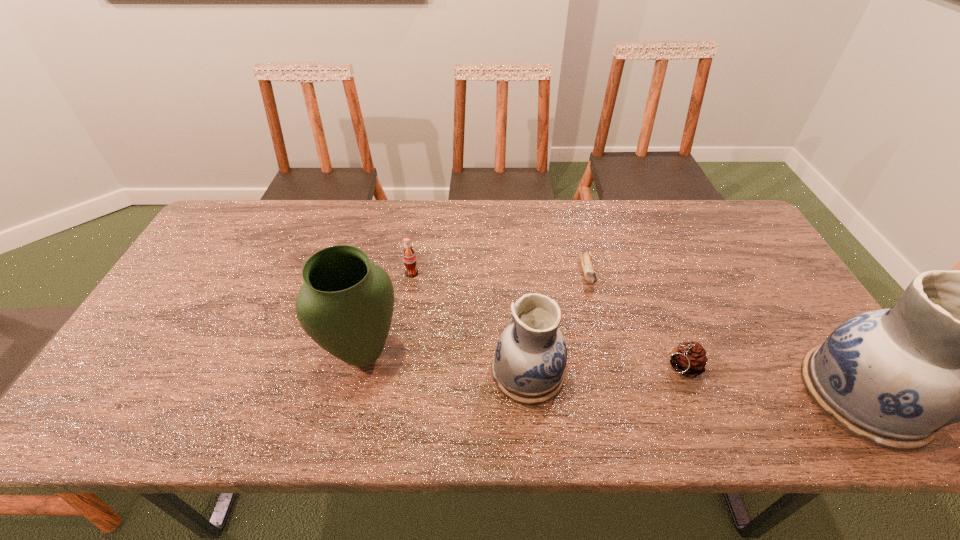
Identify the location of free location located 0.080m with a leaf charm attached to the pinecone. (627, 367).

The width and height of the screenshot is (960, 540). Find the location of `vacant space positioned 0.260m with a leaf charm attached to the pinecone`. vacant space positioned 0.260m with a leaf charm attached to the pinecone is located at coordinates (553, 367).

Image resolution: width=960 pixels, height=540 pixels. I want to click on vacant space located on the left of the fifth shortest object, so (x=279, y=353).

Identify the location of pottery located at the near edge. The width and height of the screenshot is (960, 540). (529, 364).

This screenshot has width=960, height=540. Find the location of `pinecone located at the near edge`. pinecone located at the near edge is located at coordinates (689, 359).

Image resolution: width=960 pixels, height=540 pixels. Identify the location of vase at the near edge. (345, 305).

Identify the location of vacant space at the far edge of the desktop. This screenshot has width=960, height=540. (275, 240).

Where is `vacant region at the near edge of the desktop`? This screenshot has width=960, height=540. vacant region at the near edge of the desktop is located at coordinates pos(404,375).

Where is `vacant region at the left edge of the desktop`? vacant region at the left edge of the desktop is located at coordinates (170, 299).

Find the location of a particular element. Image resolution: width=960 pixels, height=540 pixels. vacant space at the right edge of the desktop is located at coordinates (794, 330).